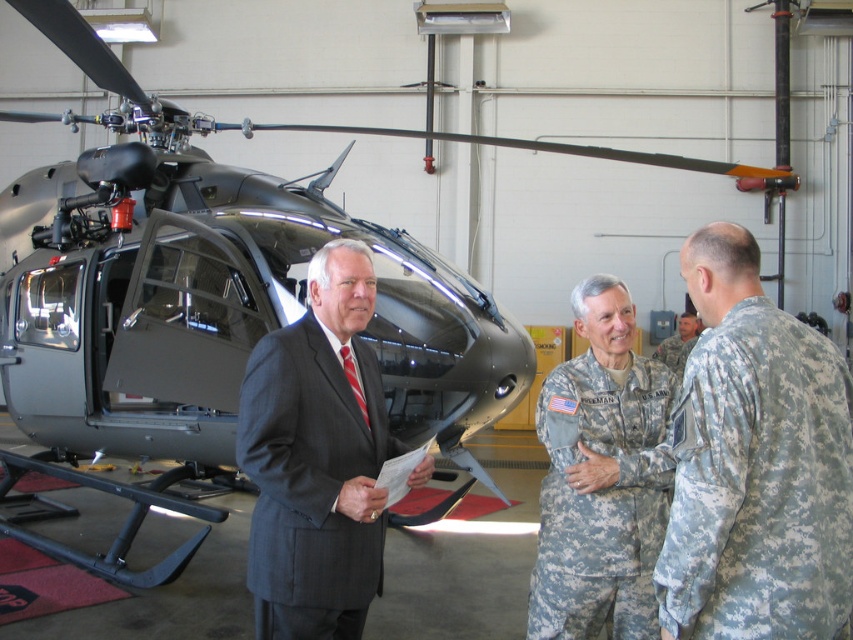
Is point (811, 476) more distant than point (583, 406)?

No, it is not.

Between camouflage fabric uniform at right and camouflage fabric uniform at center, which one has more height?

camouflage fabric uniform at center

This screenshot has height=640, width=853. In order to click on camouflage fabric uniform at right in this screenshot , I will do `click(759, 483)`.

Does camouflage fabric uniform at center have a smaller size compared to camouflage uniform at center?

Yes.

Can you confirm if camouflage fabric uniform at center is positioned to the right of camouflage uniform at center?

In fact, camouflage fabric uniform at center is to the left of camouflage uniform at center.

Is point (654, 516) farther from viewer compared to point (680, 337)?

No, it is in front of (680, 337).

You are a GUI agent. You are given a task and a screenshot of the screen. Output one action in this format:
    pyautogui.click(x=<x>, y=<y>)
    Task: Click on the camouflage fabric uniform at center
    Image resolution: width=853 pixels, height=640 pixels.
    Given the screenshot: What is the action you would take?
    pyautogui.click(x=601, y=499)

Does camouflage fabric uniform at right have a greater height compared to dark gray suit at center?

Incorrect, camouflage fabric uniform at right's height is not larger of dark gray suit at center's.

Describe the element at coordinates (759, 483) in the screenshot. This screenshot has height=640, width=853. I see `camouflage fabric uniform at right` at that location.

Does point (837, 371) lie in front of point (349, 352)?

Yes.

You are a GUI agent. You are given a task and a screenshot of the screen. Output one action in this format:
    pyautogui.click(x=<x>, y=<y>)
    Task: Click on the camouflage fabric uniform at right
    Image resolution: width=853 pixels, height=640 pixels.
    Given the screenshot: What is the action you would take?
    pyautogui.click(x=759, y=483)